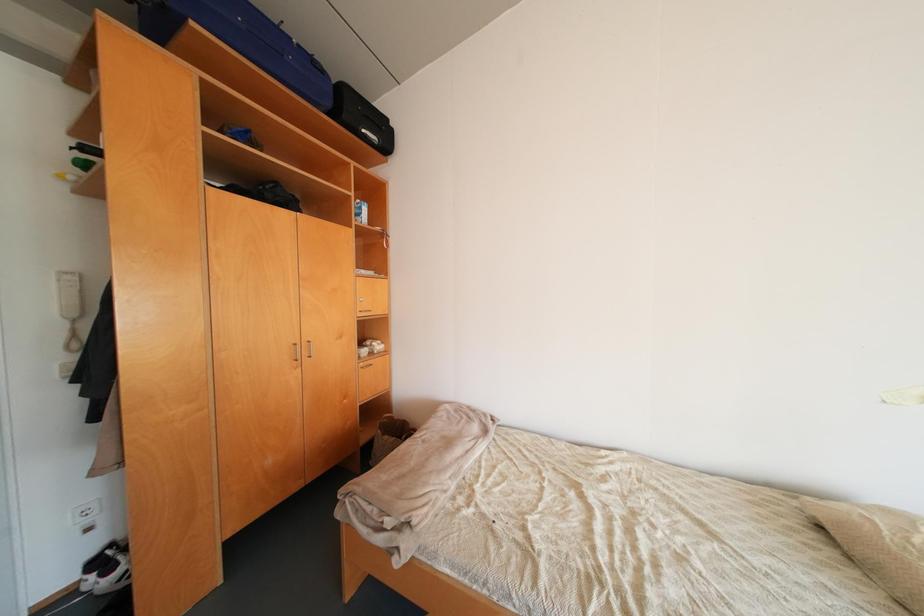
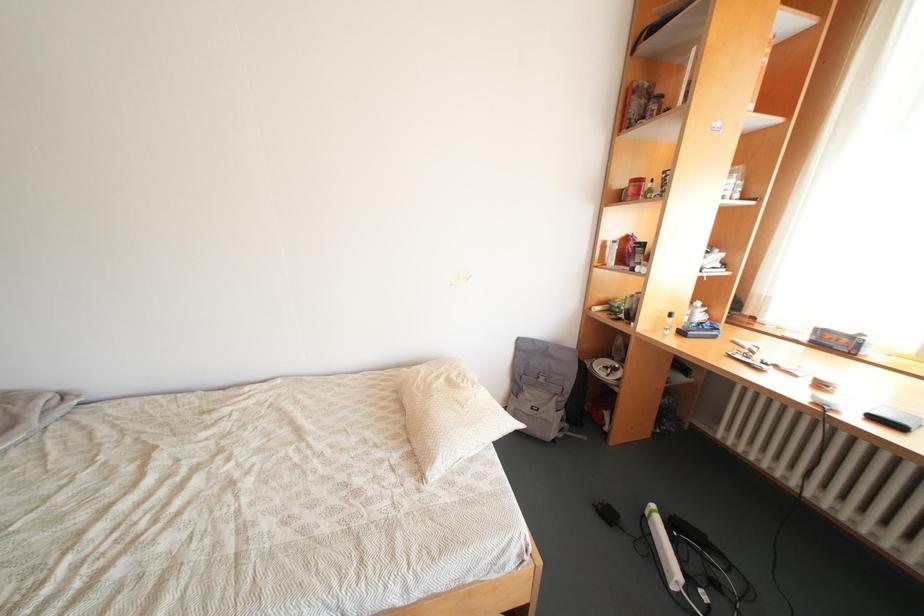
The images are taken continuously from a first-person perspective. In which direction is your viewpoint rotating?

The camera rotated toward right-down.